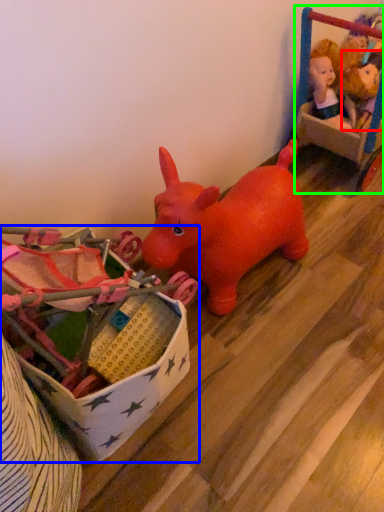
Question: Which object is positioned farthest from toy (highlighted by a red box)? Select from toy (highlighted by a blue box) and toy (highlighted by a green box).

Choices:
 (A) toy
 (B) toy

Answer: (A)